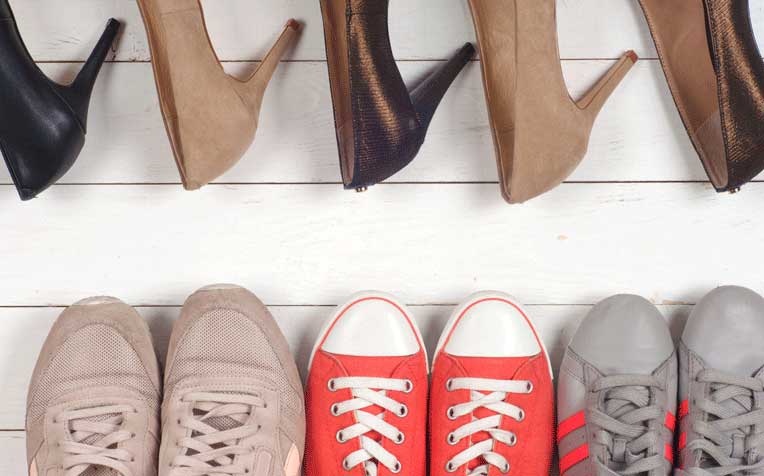
Where is `white board`? This screenshot has height=476, width=764. white board is located at coordinates (78, 42), (122, 138), (99, 283), (31, 353), (11, 444).